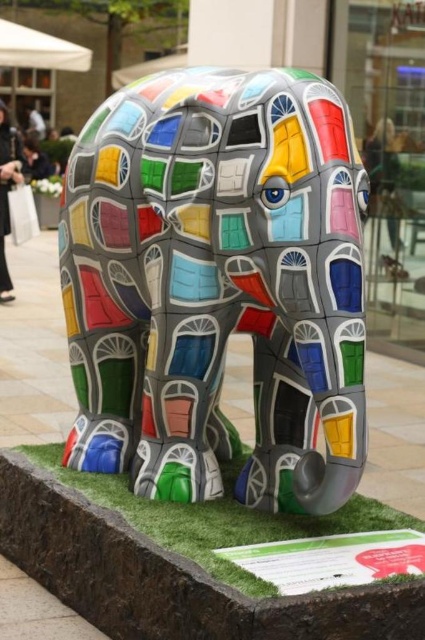
You are standing at the point marked by coordinates [218,284]. Looking around, you see the multicolored mosaic elephant at center. Is the elephant located to your left, right, in front of, behind, or at your current position?

The multicolored mosaic elephant at center is represented by point [218,284], so you are standing exactly at the location of the elephant.